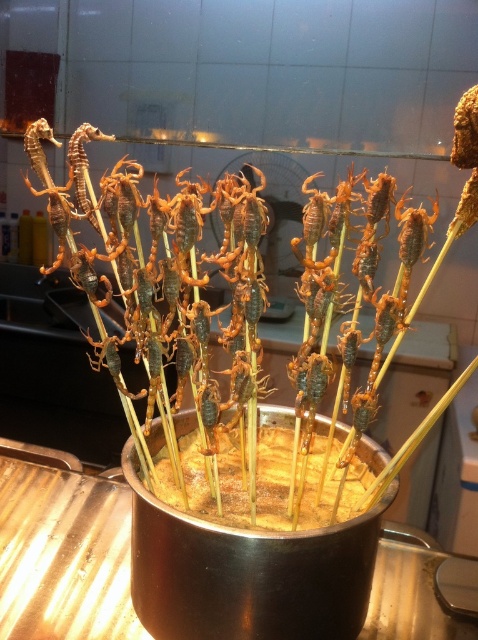
Question: Which object appears closest to the camera in this image?

Choices:
 (A) brown crispy scorpions at center
 (B) brown crunchy scorpion at center

Answer: (B)

Question: Is brown crunchy scorpion at center below brown crispy scorpions at center?

Choices:
 (A) yes
 (B) no

Answer: (B)

Question: Does brown crunchy scorpion at center appear under brown crispy scorpions at center?

Choices:
 (A) yes
 (B) no

Answer: (B)

Question: Is brown crunchy scorpion at center further to the viewer compared to brown crispy scorpions at center?

Choices:
 (A) no
 (B) yes

Answer: (A)